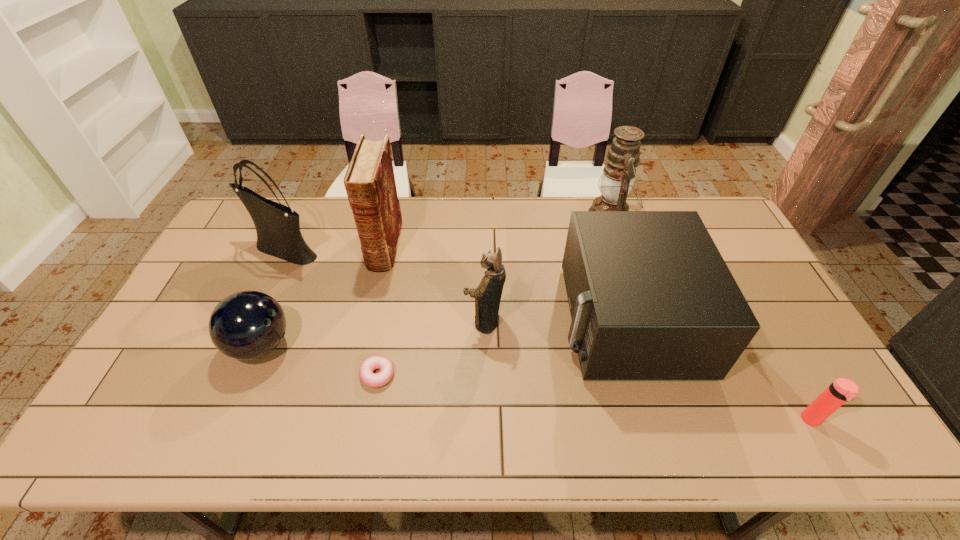
The height and width of the screenshot is (540, 960). I want to click on object that is the seventh closest to the shortest object, so click(842, 390).

Where is `free space that satisfies the following two spatial constraints: 1. on the side of the nearest object with the finger holes; 2. on the left side of the bowling ball`? The width and height of the screenshot is (960, 540). free space that satisfies the following two spatial constraints: 1. on the side of the nearest object with the finger holes; 2. on the left side of the bowling ball is located at coordinates (229, 420).

Locate an element on the screen. free space that satisfies the following two spatial constraints: 1. on the front-facing side of the thermos bottle; 2. on the right side of the microwave oven is located at coordinates (657, 420).

Locate an element on the screen. The height and width of the screenshot is (540, 960). vacant space that satisfies the following two spatial constraints: 1. on the front-facing side of the fourth shortest object; 2. on the front side of the shortest object is located at coordinates (643, 375).

Identify the location of vacant area that satisfies the following two spatial constraints: 1. on the back side of the lantern; 2. on the right side of the doughnut. (407, 217).

This screenshot has height=540, width=960. I want to click on vacant space that satisfies the following two spatial constraints: 1. on the front-facing side of the rightmost object; 2. on the left side of the figurine, so click(485, 420).